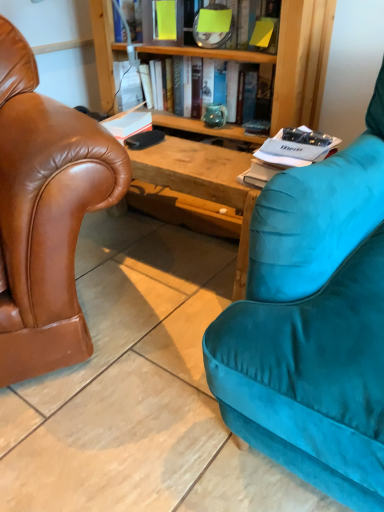
Question: In which direction should I rotate to look at white matte book at center, the 2th book when ordered from bottom to top?

Choices:
 (A) right
 (B) left

Answer: (B)

Question: Does white matte book at center, which appears as the 3th book when viewed from the top, have a lesser height compared to matte green vase at center, the 3th book when ordered from bottom to top?

Choices:
 (A) no
 (B) yes

Answer: (B)

Question: Would you say white matte book at center, which appears as the 3th book when viewed from the top, contains matte green vase at center, the 3th book when ordered from bottom to top?

Choices:
 (A) no
 (B) yes

Answer: (A)

Question: From a real-world perspective, does white matte book at center, the 2th book when ordered from bottom to top, sit lower than matte green vase at center, which is counted as the 2th book, starting from the top?

Choices:
 (A) no
 (B) yes

Answer: (B)

Question: Considering the relative positions of white matte book at center, which appears as the 3th book when viewed from the top, and matte green vase at center, the 3th book when ordered from bottom to top, in the image provided, is white matte book at center, which appears as the 3th book when viewed from the top, to the left of matte green vase at center, the 3th book when ordered from bottom to top, from the viewer's perspective?

Choices:
 (A) no
 (B) yes

Answer: (B)

Question: Are white matte book at center, the 2th book when ordered from bottom to top, and matte green vase at center, the 3th book when ordered from bottom to top, beside each other?

Choices:
 (A) yes
 (B) no

Answer: (B)

Question: Does white matte book at center, the 2th book when ordered from bottom to top, have a greater height compared to matte green vase at center, which is counted as the 2th book, starting from the top?

Choices:
 (A) no
 (B) yes

Answer: (A)

Question: Are white paper at right, the first book when ordered from bottom to top, and yellow paper at upper center, the 4th book when ordered from bottom to top, located far from each other?

Choices:
 (A) yes
 (B) no

Answer: (B)

Question: Is white paper at right, marked as the 4th book in a top-to-bottom arrangement, next to yellow paper at upper center, the 4th book when ordered from bottom to top?

Choices:
 (A) yes
 (B) no

Answer: (B)

Question: Is white paper at right, the first book when ordered from bottom to top, bigger than yellow paper at upper center, the 4th book when ordered from bottom to top?

Choices:
 (A) yes
 (B) no

Answer: (B)

Question: Can you confirm if white paper at right, the first book when ordered from bottom to top, is positioned to the right of yellow paper at upper center, which is the first book in top-to-bottom order?

Choices:
 (A) no
 (B) yes

Answer: (B)

Question: Can you confirm if white paper at right, the first book when ordered from bottom to top, is smaller than yellow paper at upper center, which is the first book in top-to-bottom order?

Choices:
 (A) no
 (B) yes

Answer: (B)

Question: Is white paper at right, the first book when ordered from bottom to top, in front of yellow paper at upper center, the 4th book when ordered from bottom to top?

Choices:
 (A) no
 (B) yes

Answer: (B)

Question: Can you confirm if matte ceramic vase at center is bigger than white paper at right, marked as the 4th book in a top-to-bottom arrangement?

Choices:
 (A) yes
 (B) no

Answer: (B)